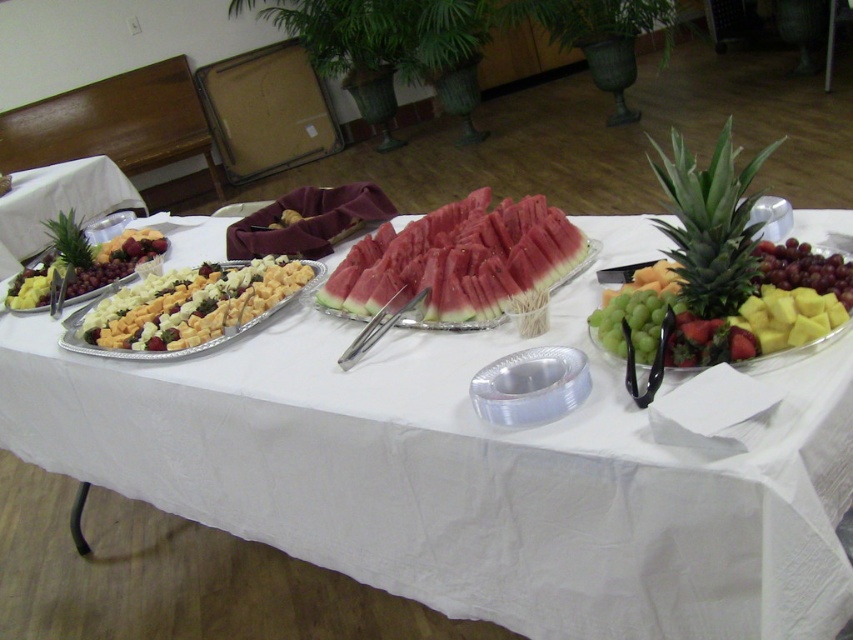
You are a caterer arranging a buffet table. You have a white cheese at center and a maroon fabric at center. Which item should you adjust if you need to make space for a new fruit platter that requires more width than the current setup? Explain your reasoning.

A: The white cheese at center has a larger width than the maroon fabric at center. Since the white cheese is wider, adjusting its position or reducing its size would create more space for the new fruit platter.

You are a guest at a buffet and want to reach for the pink flesh watermelon at center. However, there is a maroon fabric at center in the way. Can you tell me if the watermelon is higher than the fabric?

The pink flesh watermelon at center is taller than the maroon fabric at center, so yes, the watermelon is higher than the fabric.

You are planning to place a decorative bowl on the table. The bowl requires a space larger than the yellow matte pineapple at right. Can you use the area where the white fabric at center is located?

The white fabric at center is larger in size than the yellow matte pineapple at right, so yes, the area where the white fabric at center is located provides sufficient space for the decorative bowl.